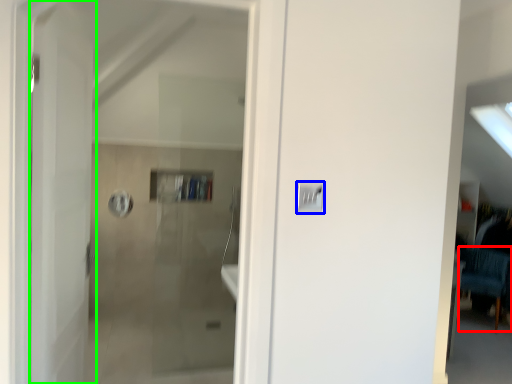
Question: Considering the real-world distances, which object is closest to furniture (highlighted by a red box)? light switch (highlighted by a blue box) or door (highlighted by a green box).

Choices:
 (A) light switch
 (B) door

Answer: (A)